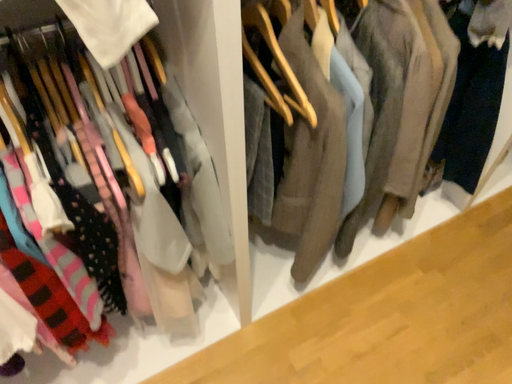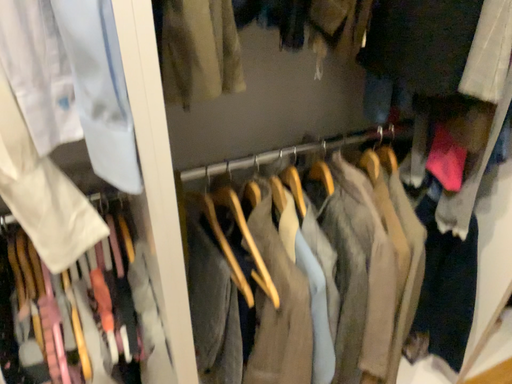
Question: Which way did the camera rotate in the video?

Choices:
 (A) rotated upward
 (B) rotated downward

Answer: (A)